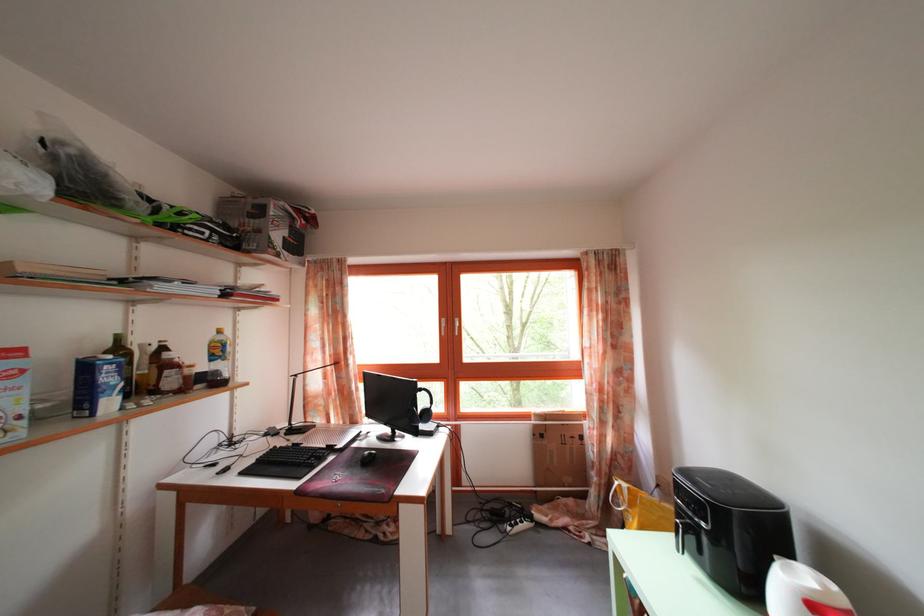
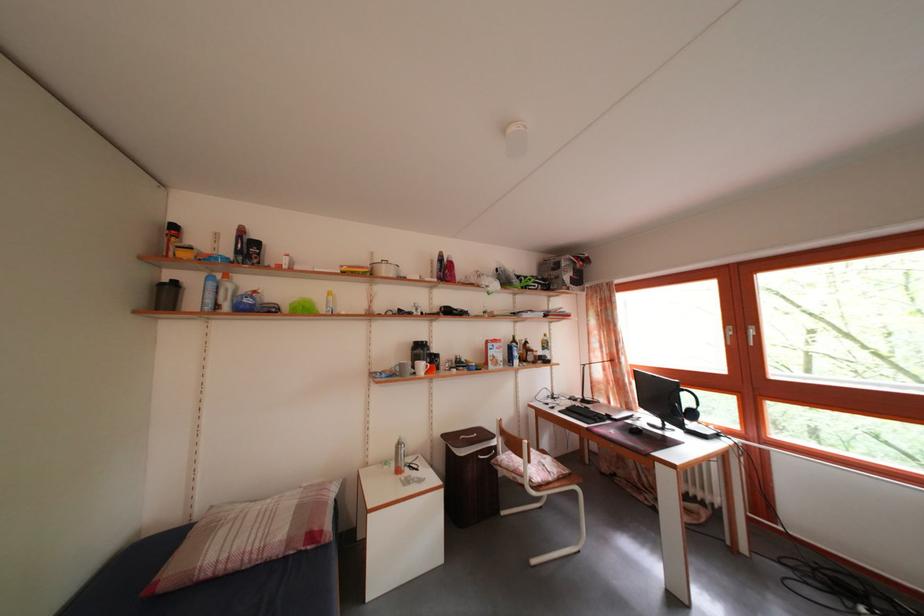
Question: The camera is either moving clockwise (left) or counter-clockwise (right) around the object. The first image is from the beginning of the video and the second image is from the end. Is the camera moving left or right when shooting the video?

Choices:
 (A) Left
 (B) Right

Answer: (B)